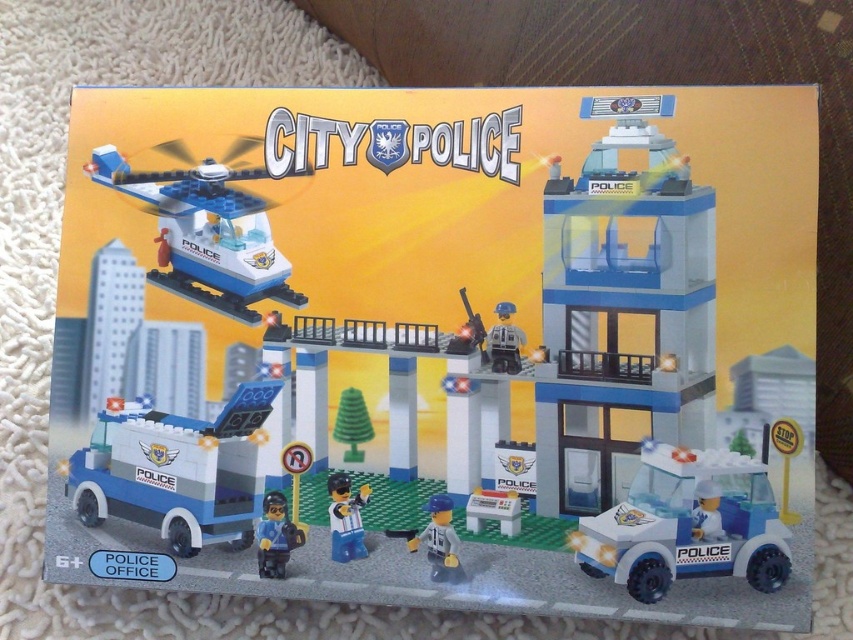
Question: Which point is closer to the camera?

Choices:
 (A) (508, 340)
 (B) (357, 451)
 (C) (281, 538)

Answer: (A)

Question: Is light gray plastic minifigure at center in front of gray matte figure at center?

Choices:
 (A) yes
 (B) no

Answer: (A)

Question: Is blue plastic police van at lower left further to camera compared to blue plastic helicopter at upper left?

Choices:
 (A) yes
 (B) no

Answer: (B)

Question: Which of these objects is positioned farthest from the white glossy figure at center?

Choices:
 (A) blue plastic police van at lower left
 (B) gray matte figure at center
 (C) light gray plastic minifigure at center

Answer: (B)

Question: Is blue plastic helicopter at upper left thinner than white glossy figure at center?

Choices:
 (A) yes
 (B) no

Answer: (B)

Question: Estimate the real-world distances between objects in this image. Which object is farther from the black plastic minifigure at lower center?

Choices:
 (A) white glossy figure at center
 (B) gray matte figure at center
 (C) white plastic police car at lower right
 (D) blue plastic police van at lower left

Answer: (C)